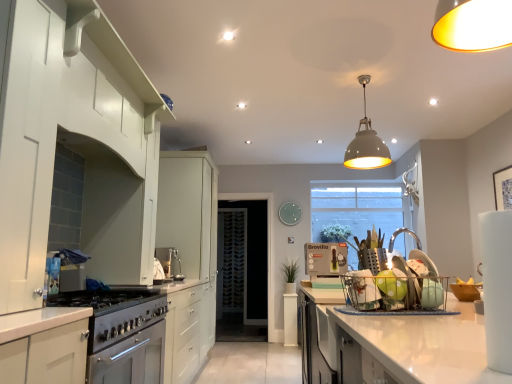
Question: From a real-world perspective, does green plastic kettle at center sit lower than satin silver gas stove at lower left?

Choices:
 (A) yes
 (B) no

Answer: (B)

Question: Considering the relative sizes of green plastic kettle at center and satin silver gas stove at lower left in the image provided, is green plastic kettle at center wider than satin silver gas stove at lower left?

Choices:
 (A) yes
 (B) no

Answer: (B)

Question: Are green plastic kettle at center and satin silver gas stove at lower left located far from each other?

Choices:
 (A) no
 (B) yes

Answer: (B)

Question: Is green plastic kettle at center closer to camera compared to satin silver gas stove at lower left?

Choices:
 (A) no
 (B) yes

Answer: (A)

Question: Does green plastic kettle at center have a lesser height compared to satin silver gas stove at lower left?

Choices:
 (A) yes
 (B) no

Answer: (B)

Question: Does green plastic kettle at center come behind satin silver gas stove at lower left?

Choices:
 (A) no
 (B) yes

Answer: (B)

Question: Is green matte plant at center not inside white glossy cabinet at left, which ranks as the first cabinetry in back-to-front order?

Choices:
 (A) no
 (B) yes

Answer: (B)

Question: Does green matte plant at center have a smaller size compared to white glossy cabinet at left, acting as the third cabinetry starting from the front?

Choices:
 (A) no
 (B) yes

Answer: (B)

Question: Is white glossy cabinet at left, acting as the third cabinetry starting from the front, inside green matte plant at center?

Choices:
 (A) no
 (B) yes

Answer: (A)

Question: Is green matte plant at center oriented towards white glossy cabinet at left, acting as the third cabinetry starting from the front?

Choices:
 (A) no
 (B) yes

Answer: (A)

Question: From the image's perspective, is green matte plant at center below white glossy cabinet at left, which ranks as the first cabinetry in back-to-front order?

Choices:
 (A) yes
 (B) no

Answer: (A)

Question: Considering the relative positions of green matte plant at center and white glossy cabinet at left, acting as the third cabinetry starting from the front, in the image provided, is green matte plant at center to the left of white glossy cabinet at left, acting as the third cabinetry starting from the front, from the viewer's perspective?

Choices:
 (A) no
 (B) yes

Answer: (A)

Question: Considering the relative sizes of transparent glass door at center and satin silver coffee machine at center, the 2th appliance viewed from the back, in the image provided, is transparent glass door at center taller than satin silver coffee machine at center, the 2th appliance viewed from the back,?

Choices:
 (A) no
 (B) yes

Answer: (B)